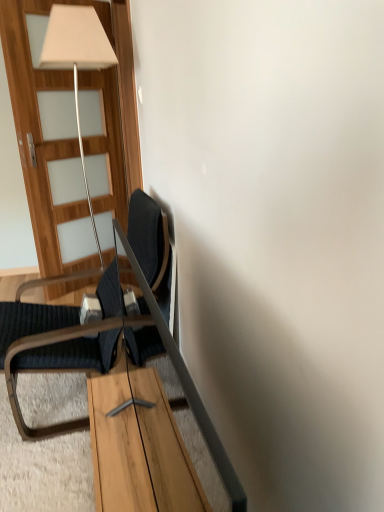
Locate an element on the screen. This screenshot has width=384, height=512. wooden table at center is located at coordinates (117, 449).

At what (x,y) coordinates should I click in order to perform the action: click on wooden table at center. Please return your answer as a coordinate pair (x, y). The height and width of the screenshot is (512, 384). Looking at the image, I should click on (117, 449).

Is dark blue fabric chair at left aimed at wooden table at center?

No.

From the picture: Considering the positions of objects dark blue fabric chair at left and wooden table at center in the image provided, who is more to the left, dark blue fabric chair at left or wooden table at center?

Positioned to the left is dark blue fabric chair at left.

Does dark blue fabric chair at left come in front of wooden table at center?

No, dark blue fabric chair at left is further to the viewer.

Does dark blue fabric chair at left have a greater width compared to wooden table at center?

Yes, dark blue fabric chair at left is wider than wooden table at center.

Does point (110, 75) come closer to viewer compared to point (110, 378)?

No, it is behind (110, 378).

In order to click on door that appears above the wooden table at center (from a real-world perspective) in this screenshot , I will do click(x=41, y=128).

Is wooden door at left placed right next to wooden table at center?

No, wooden door at left is not making contact with wooden table at center.

Consider the image. Is wooden door at left completely or partially outside of wooden table at center?

wooden door at left is positioned outside wooden table at center.

Does point (121, 178) come behind point (81, 365)?

Yes.

Is wooden door at left oriented towards dark blue fabric chair at left?

No.

Consider the image. Is wooden door at left positioned behind dark blue fabric chair at left?

Yes, the depth of wooden door at left is greater than that of dark blue fabric chair at left.

How many degrees apart are the facing directions of wooden door at left and dark blue fabric chair at left?

wooden door at left and dark blue fabric chair at left are facing 0.113 degrees away from each other.

From the image's perspective, between wooden table at center and dark blue fabric chair at left, who is located below?

wooden table at center is shown below in the image.

The width and height of the screenshot is (384, 512). Identify the location of chair located behind the wooden table at center. (57, 341).

Considering the positions of objects wooden table at center and dark blue fabric chair at left in the image provided, who is more to the right, wooden table at center or dark blue fabric chair at left?

From the viewer's perspective, wooden table at center appears more on the right side.

Considering the sizes of objects wooden table at center and dark blue fabric chair at left in the image provided, who is thinner, wooden table at center or dark blue fabric chair at left?

wooden table at center.

Where is `door behind the dark blue fabric chair at left`? The width and height of the screenshot is (384, 512). door behind the dark blue fabric chair at left is located at coordinates (41, 128).

Are dark blue fabric chair at left and wooden door at left far apart?

Yes, dark blue fabric chair at left and wooden door at left are located far from each other.

Who is smaller, dark blue fabric chair at left or wooden door at left?

wooden door at left is smaller.

Considering the relative positions of dark blue fabric chair at left and wooden door at left in the image provided, is dark blue fabric chair at left to the right of wooden door at left from the viewer's perspective?

No, dark blue fabric chair at left is not to the right of wooden door at left.

From the image's perspective, is wooden table at center beneath wooden door at left?

Yes, from the image's perspective, wooden table at center is below wooden door at left.

Can you confirm if wooden table at center is wider than wooden door at left?

No.

Is wooden table at center smaller than wooden door at left?

Indeed, wooden table at center has a smaller size compared to wooden door at left.

Can you confirm if wooden table at center is positioned to the left of wooden door at left?

No, wooden table at center is not to the left of wooden door at left.

Where is `table below the dark blue fabric chair at left (from the image's perspective)`? This screenshot has width=384, height=512. table below the dark blue fabric chair at left (from the image's perspective) is located at coordinates pyautogui.click(x=117, y=449).

I want to click on table below the wooden door at left (from a real-world perspective), so click(117, 449).

Estimate the real-world distances between objects in this image. Which object is closer to dark blue fabric chair at left, wooden table at center or wooden door at left?

wooden table at center.

From the picture: Estimate the real-world distances between objects in this image. Which object is closer to wooden table at center, wooden door at left or dark blue fabric chair at left?

dark blue fabric chair at left is closer to wooden table at center.

Looking at the image, which one is located closer to dark blue fabric chair at left, wooden door at left or wooden table at center?

wooden table at center.

Estimate the real-world distances between objects in this image. Which object is further from wooden door at left, dark blue fabric chair at left or wooden table at center?

wooden table at center is positioned further to the anchor wooden door at left.

Looking at the image, which one is located closer to wooden table at center, dark blue fabric chair at left or wooden door at left?

Based on the image, dark blue fabric chair at left appears to be nearer to wooden table at center.

Looking at the image, which one is located further to wooden door at left, wooden table at center or dark blue fabric chair at left?

wooden table at center.

The width and height of the screenshot is (384, 512). I want to click on chair that lies between wooden door at left and wooden table at center from top to bottom, so click(57, 341).